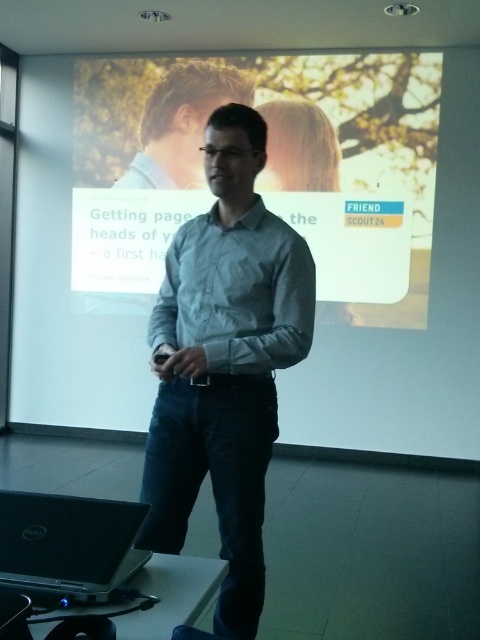
Who is lower down, light blue shirt at center or black matte laptop at lower left?

Positioned lower is black matte laptop at lower left.

Describe the element at coordinates (225, 362) in the screenshot. The height and width of the screenshot is (640, 480). I see `light blue shirt at center` at that location.

The image size is (480, 640). What are the coordinates of `light blue shirt at center` in the screenshot? It's located at pyautogui.click(x=225, y=362).

Locate an element on the screen. The image size is (480, 640). black matte laptop at lower left is located at coordinates (68, 545).

Is point (24, 500) positioned behind point (253, 88)?

No, it is not.

Where is `black matte laptop at lower left`? This screenshot has width=480, height=640. black matte laptop at lower left is located at coordinates (68, 545).

Who is higher up, light blue shirt at center or light brown hair at center?

light brown hair at center

Who is positioned more to the left, light blue shirt at center or light brown hair at center?

light brown hair at center is more to the left.

At what (x,y) coordinates should I click in order to perform the action: click on light blue shirt at center. Please return your answer as a coordinate pair (x, y). Looking at the image, I should click on point(225,362).

Find the location of `light blue shirt at center`. light blue shirt at center is located at coordinates (225, 362).